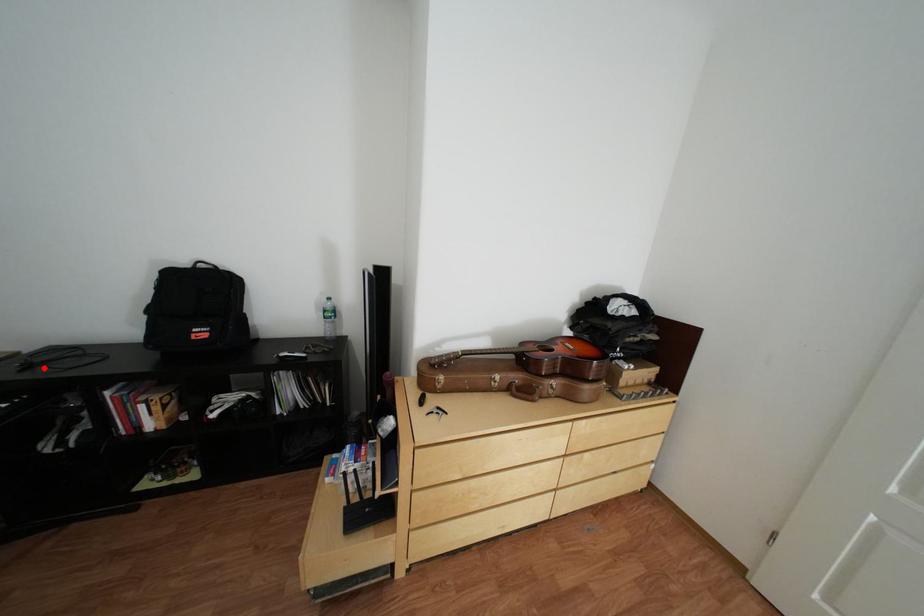
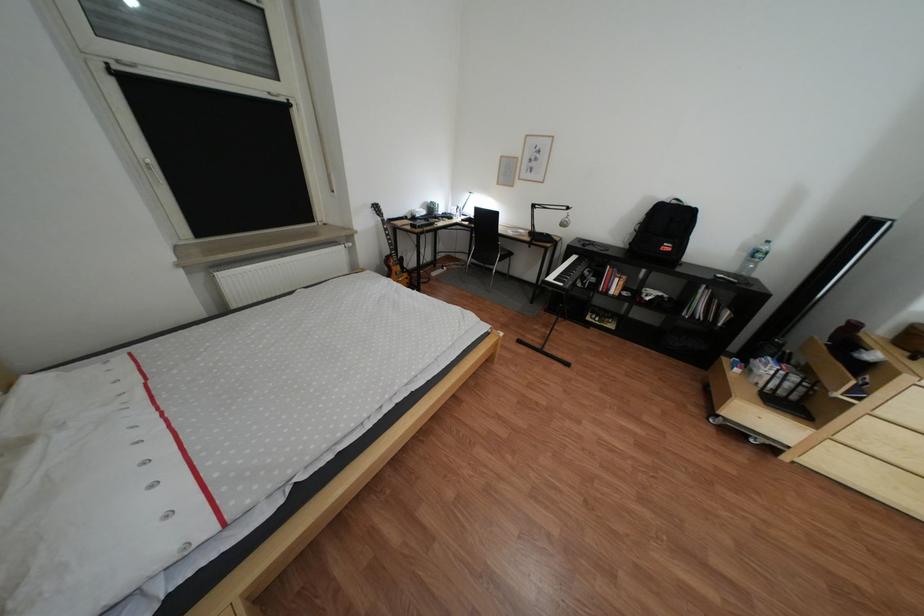
Question: I am providing you with two images of the same scene from different viewpoints. A red point is shown in image1. For the corresponding object point in image2, is it positioned nearer or farther from the camera?

Choices:
 (A) Nearer
 (B) Farther

Answer: (A)